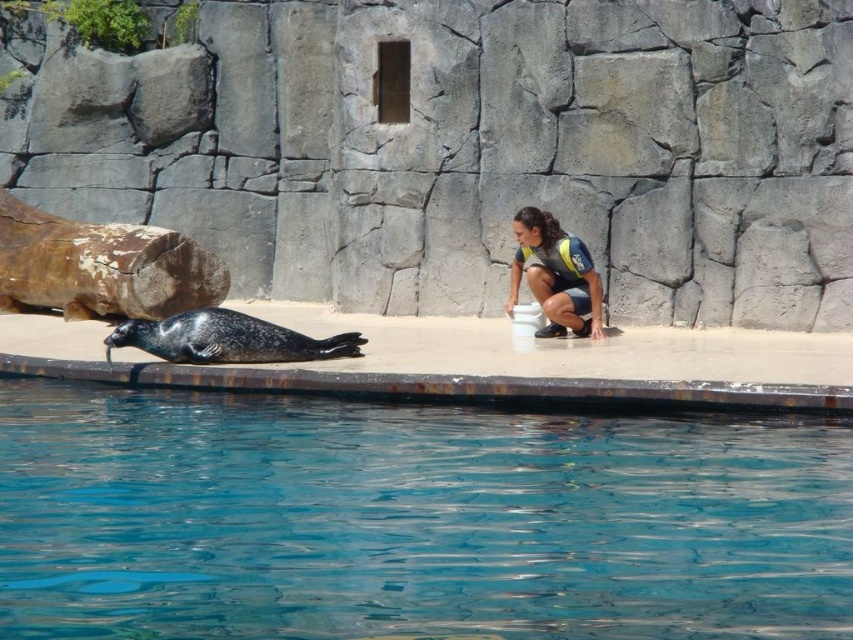
You are a zookeeper standing at the edge of the enclosure. You need to reach the gray fur seal at center to give it a treat. However, there is transparent glass water at lower center in your path. Can you walk directly to the seal without stepping into the water?

The transparent glass water at lower center is in front of the gray fur seal at center, so to reach the seal, you would have to step over or around the water. Since you cannot walk through water, you cannot go directly to the seal without stepping into the water.